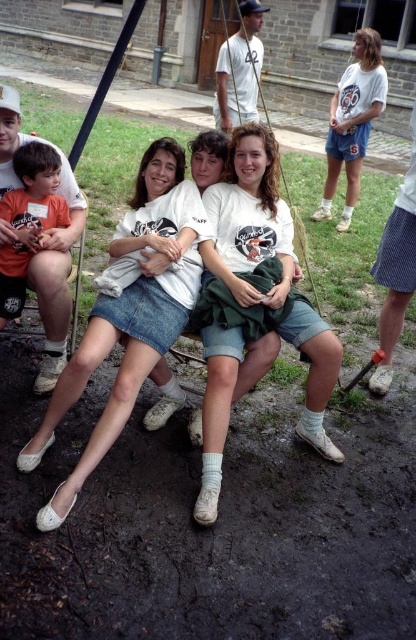
In the scene shown: You are a photographer trying to capture a group photo of the denim skirt at center and orange cotton shirt at left. If you want to ensure both subjects are fully visible in the frame, which subject should you position closer to the camera?

The denim skirt at center might be wider than orange cotton shirt at left, so to ensure both are fully visible, position the denim skirt at center closer to the camera to avoid it being cropped out.

You are a photographer trying to capture a group photo of the denim skirt at center and the white cotton shirt at center. Which clothing item would you need to adjust your camera angle to accommodate due to its larger size?

The denim skirt at center has a greater width than the white cotton shirt at center, so you would need to adjust your camera angle to accommodate the denim skirt at center.

You are standing at the origin point of the image coordinate system. The image coordinate system has the origin at the bottom left corner. The coordinates are normalized between 0 and 1. Where is the denim skirt at center located in the image coordinate system?

The denim skirt at center is located at point (128, 317) in the image coordinate system.